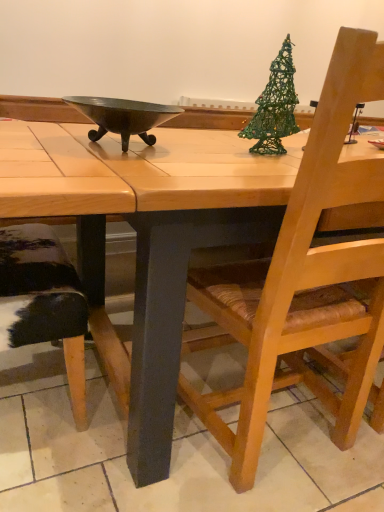
Image resolution: width=384 pixels, height=512 pixels. Find the location of `vacant space in metallic dark gray bowl at center (from a real-world perspective)`. vacant space in metallic dark gray bowl at center (from a real-world perspective) is located at coordinates (120, 148).